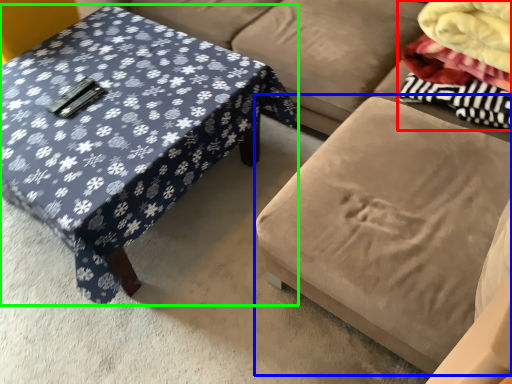
Question: Based on their relative distances, which object is farther from fabric (highlighted by a red box)? Choose from swivel chair (highlighted by a blue box) and coffee table (highlighted by a green box).

Choices:
 (A) swivel chair
 (B) coffee table

Answer: (B)